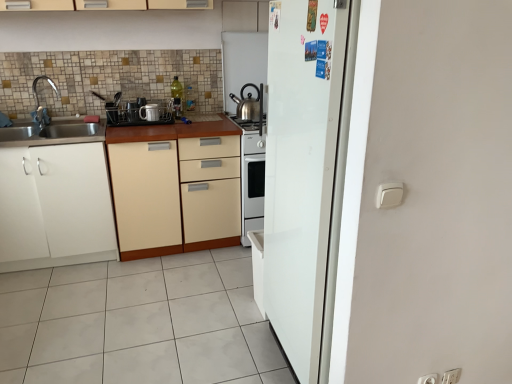
Locate an element on the screen. The height and width of the screenshot is (384, 512). blank space situated above beige matte cabinet at center, positioned as the first cabinetry in right-to-left order (from a real-world perspective) is located at coordinates (172, 123).